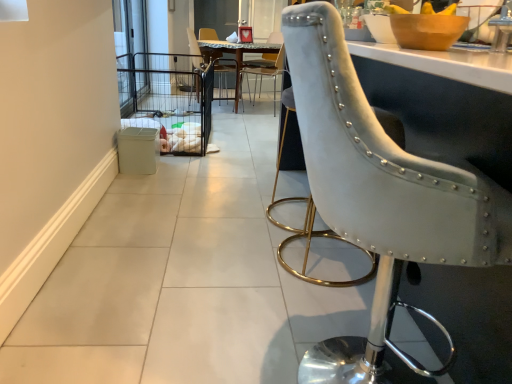
The image size is (512, 384). What do you see at coordinates (264, 75) in the screenshot?
I see `metallic gold chair at center, which appears as the 2th chair when viewed from the front` at bounding box center [264, 75].

The width and height of the screenshot is (512, 384). In order to click on marble top table at center in this screenshot , I will do `click(234, 56)`.

Measure the distance between suede-like gray chair at right, arranged as the third chair when viewed from the back, and camera.

A distance of 38.53 inches exists between suede-like gray chair at right, arranged as the third chair when viewed from the back, and camera.

Find the location of a particular element. The width and height of the screenshot is (512, 384). suede-like gray chair at right, which is counted as the 1th chair, starting from the front is located at coordinates (392, 178).

Identify the location of metallic gold chair at center, the 2th chair in the back-to-front sequence. This screenshot has height=384, width=512. (264, 75).

Is white plastic trash bin at lower left taller than marble top table at center?

No.

From the image's perspective, is white plastic trash bin at lower left located above or below marble top table at center?

Based on their image positions, white plastic trash bin at lower left is located beneath marble top table at center.

How much distance is there between white plastic trash bin at lower left and marble top table at center?

white plastic trash bin at lower left and marble top table at center are 2.17 meters apart from each other.

Could marble top table at center be considered to be inside white plastic trash bin at lower left?

No, marble top table at center is located outside of white plastic trash bin at lower left.

Is marble top table at center not close to suede-like gray chair at right, which is counted as the 1th chair, starting from the front?

That's right, there is a large distance between marble top table at center and suede-like gray chair at right, which is counted as the 1th chair, starting from the front.

Which object is further away from the camera taking this photo, marble top table at center or suede-like gray chair at right, which is counted as the 1th chair, starting from the front?

marble top table at center is more distant.

Which object is positioned more to the left, marble top table at center or suede-like gray chair at right, which is counted as the 1th chair, starting from the front?

marble top table at center.

Is the surface of marble top table at center in direct contact with clear glass screen door at upper left?

No, marble top table at center is not in contact with clear glass screen door at upper left.

Does marble top table at center turn towards clear glass screen door at upper left?

No, marble top table at center is not oriented towards clear glass screen door at upper left.

Considering the points (234, 58) and (137, 51), which point is in front, point (234, 58) or point (137, 51)?

Positioned in front is point (137, 51).

Considering the sizes of marble top table at center and clear glass screen door at upper left in the image, is marble top table at center bigger or smaller than clear glass screen door at upper left?

Considering their sizes, marble top table at center takes up more space than clear glass screen door at upper left.

At what (x,y) coordinates should I click in order to perform the action: click on kitchen & dining room table on the right of white plastic trash bin at lower left. Please return your answer as a coordinate pair (x, y). Looking at the image, I should click on (234, 56).

Is marble top table at center thinner than white plastic trash bin at lower left?

Result: In fact, marble top table at center might be wider than white plastic trash bin at lower left.

Do you think marble top table at center is within white plastic trash bin at lower left, or outside of it?

The correct answer is: outside.

Is marble top table at center oriented towards white plastic trash bin at lower left?

No, marble top table at center is not turned towards white plastic trash bin at lower left.

Is white plastic trash bin at lower left aimed at clear glass screen door at upper left?

No, white plastic trash bin at lower left is not turned towards clear glass screen door at upper left.

Is white plastic trash bin at lower left shorter than clear glass screen door at upper left?

Correct, white plastic trash bin at lower left is not as tall as clear glass screen door at upper left.

Is the position of white plastic trash bin at lower left more distant than that of clear glass screen door at upper left?

No.

Is suede-like gray chair at right, which is counted as the 1th chair, starting from the front, taller than metallic gold chair at center, the 2th chair in the back-to-front sequence?

Yes.

Which is closer to the camera, [448,283] or [274,100]?

The point [448,283] is closer to the camera.

From a real-world perspective, who is located higher, suede-like gray chair at right, which is counted as the 1th chair, starting from the front, or metallic gold chair at center, which appears as the 2th chair when viewed from the front?

suede-like gray chair at right, which is counted as the 1th chair, starting from the front, is physically above.

From the image's perspective, who appears lower, metallic black chair at center, which appears as the 1th chair when viewed from the back, or metallic gold chair at center, which appears as the 2th chair when viewed from the front?

metallic gold chair at center, which appears as the 2th chair when viewed from the front.

Is metallic black chair at center, the 3th chair in the front-to-back sequence, inside the boundaries of metallic gold chair at center, the 2th chair in the back-to-front sequence, or outside?

The correct answer is: outside.

Are metallic black chair at center, the 3th chair in the front-to-back sequence, and metallic gold chair at center, which appears as the 2th chair when viewed from the front, beside each other?

No.

Find the location of a particular element. Image resolution: width=512 pixels, height=384 pixels. kitchen & dining room table above the white plastic trash bin at lower left (from a real-world perspective) is located at coordinates (234, 56).

Where is `kitchen & dining room table located above the suede-like gray chair at right, which is counted as the 1th chair, starting from the front (from the image's perspective)`? The image size is (512, 384). kitchen & dining room table located above the suede-like gray chair at right, which is counted as the 1th chair, starting from the front (from the image's perspective) is located at coordinates (234, 56).

Based on their spatial positions, is suede-like gray chair at right, which is counted as the 1th chair, starting from the front, or white plastic trash bin at lower left closer to metallic gold chair at center, the 2th chair in the back-to-front sequence?

white plastic trash bin at lower left is positioned closer to the anchor metallic gold chair at center, the 2th chair in the back-to-front sequence.

Estimate the real-world distances between objects in this image. Which object is closer to marble top table at center, metallic black chair at center, the 3th chair in the front-to-back sequence, or wooden bowl at upper right?

Based on the image, metallic black chair at center, the 3th chair in the front-to-back sequence, appears to be nearer to marble top table at center.

Looking at the image, which one is located closer to metallic gold chair at center, which appears as the 2th chair when viewed from the front, marble top table at center or clear glass screen door at upper left?

Based on the image, marble top table at center appears to be nearer to metallic gold chair at center, which appears as the 2th chair when viewed from the front.

Considering their positions, is white plastic trash bin at lower left positioned closer to suede-like gray chair at right, arranged as the third chair when viewed from the back, than marble top table at center?

white plastic trash bin at lower left is closer to suede-like gray chair at right, arranged as the third chair when viewed from the back.

When comparing their distances from wooden bowl at upper right, does white plastic trash bin at lower left or suede-like gray chair at right, arranged as the third chair when viewed from the back, seem closer?

suede-like gray chair at right, arranged as the third chair when viewed from the back, is positioned closer to the anchor wooden bowl at upper right.

Looking at the image, which one is located further to wooden bowl at upper right, metallic gold chair at center, which appears as the 2th chair when viewed from the front, or marble top table at center?

Based on the image, marble top table at center appears to be further to wooden bowl at upper right.

Estimate the real-world distances between objects in this image. Which object is further from wooden bowl at upper right, metallic black chair at center, the 3th chair in the front-to-back sequence, or marble top table at center?

metallic black chair at center, the 3th chair in the front-to-back sequence.

Based on their spatial positions, is metallic gold chair at center, the 2th chair in the back-to-front sequence, or suede-like gray chair at right, arranged as the third chair when viewed from the back, further from clear glass screen door at upper left?

suede-like gray chair at right, arranged as the third chair when viewed from the back, is positioned further to the anchor clear glass screen door at upper left.

This screenshot has height=384, width=512. I want to click on chair positioned between suede-like gray chair at right, which is counted as the 1th chair, starting from the front, and metallic black chair at center, the 3th chair in the front-to-back sequence, from near to far, so click(264, 75).

Where is `bowl positioned between suede-like gray chair at right, arranged as the third chair when viewed from the back, and clear glass screen door at upper left from near to far`? This screenshot has height=384, width=512. bowl positioned between suede-like gray chair at right, arranged as the third chair when viewed from the back, and clear glass screen door at upper left from near to far is located at coordinates (426, 30).

In order to click on screen door located between suede-like gray chair at right, arranged as the third chair when viewed from the back, and marble top table at center in the depth direction in this screenshot , I will do `click(130, 33)`.

Locate an element on the screen. trash bin/can between suede-like gray chair at right, arranged as the third chair when viewed from the back, and marble top table at center, along the z-axis is located at coordinates (138, 150).